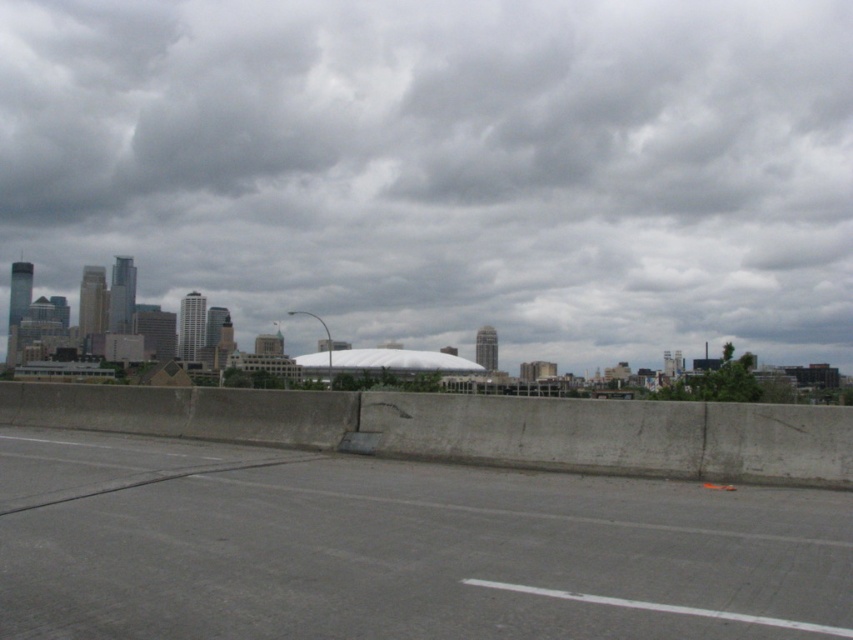
Question: Among these points, which one is farthest from the camera?

Choices:
 (A) (630, 49)
 (B) (492, 496)

Answer: (A)

Question: Can you confirm if gray cloudy sky at upper center is positioned above gray concrete highway at lower center?

Choices:
 (A) yes
 (B) no

Answer: (A)

Question: Can you confirm if gray cloudy sky at upper center is positioned to the right of gray concrete highway at lower center?

Choices:
 (A) no
 (B) yes

Answer: (B)

Question: Which of the following is the closest to the observer?

Choices:
 (A) gray concrete highway at lower center
 (B) gray cloudy sky at upper center

Answer: (A)

Question: Can you confirm if gray cloudy sky at upper center is positioned to the right of gray concrete highway at lower center?

Choices:
 (A) no
 (B) yes

Answer: (B)